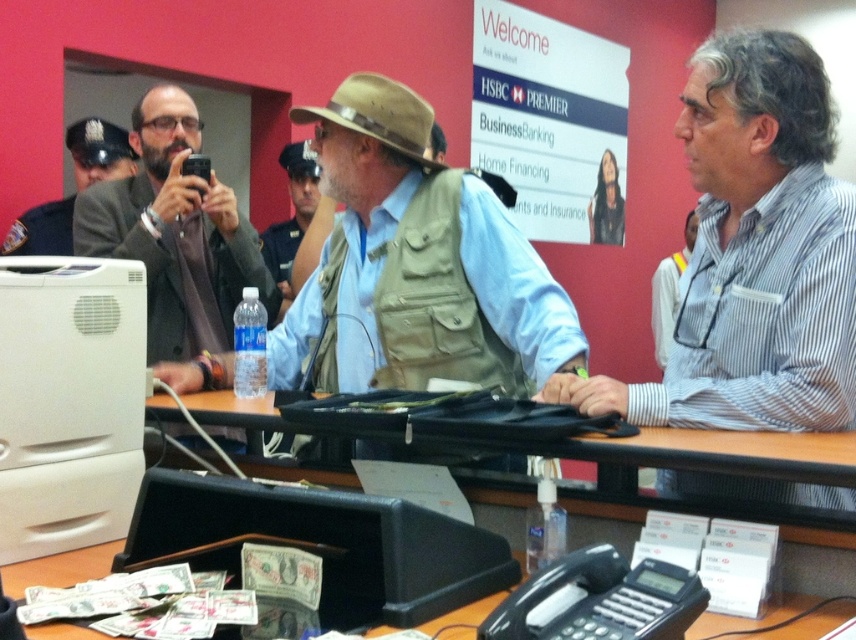
You are a customer service representative in the bank. You need to determine which item takes up more space on the counter between the dark gray uniform at left and the tan fabric vest at center. Which one should you choose?

The tan fabric vest at center takes up more space than the dark gray uniform at left, so you should choose the tan fabric vest at center as the one that occupies more space.